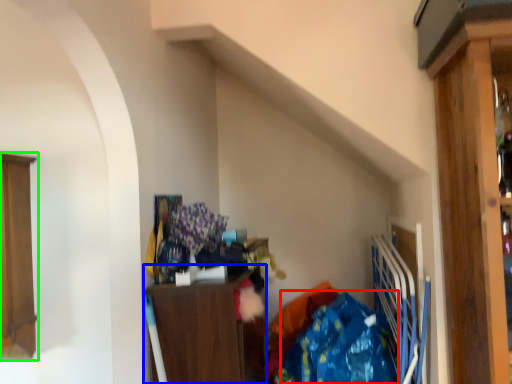
Question: Which object is positioned closest to clothing (highlighted by a red box)? Select from cabinetry (highlighted by a blue box) and cabinetry (highlighted by a green box).

Choices:
 (A) cabinetry
 (B) cabinetry

Answer: (A)